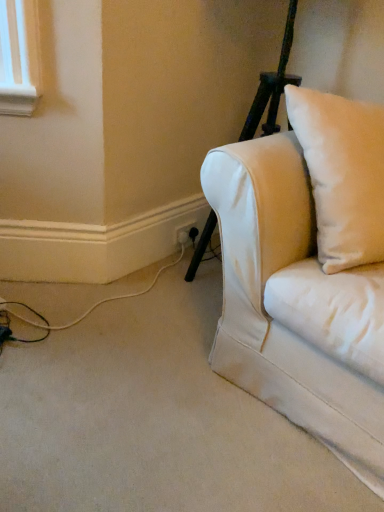
Describe the element at coordinates (186, 234) in the screenshot. The image size is (384, 512). I see `white plastic electric outlet at lower center` at that location.

Based on the photo, what is the approximate width of white plastic electric outlet at lower center?

The width of white plastic electric outlet at lower center is 0.79 inches.

The height and width of the screenshot is (512, 384). What are the coordinates of `white plastic electric outlet at lower center` in the screenshot? It's located at (186, 234).

I want to click on white plastic electric outlet at lower center, so click(186, 234).